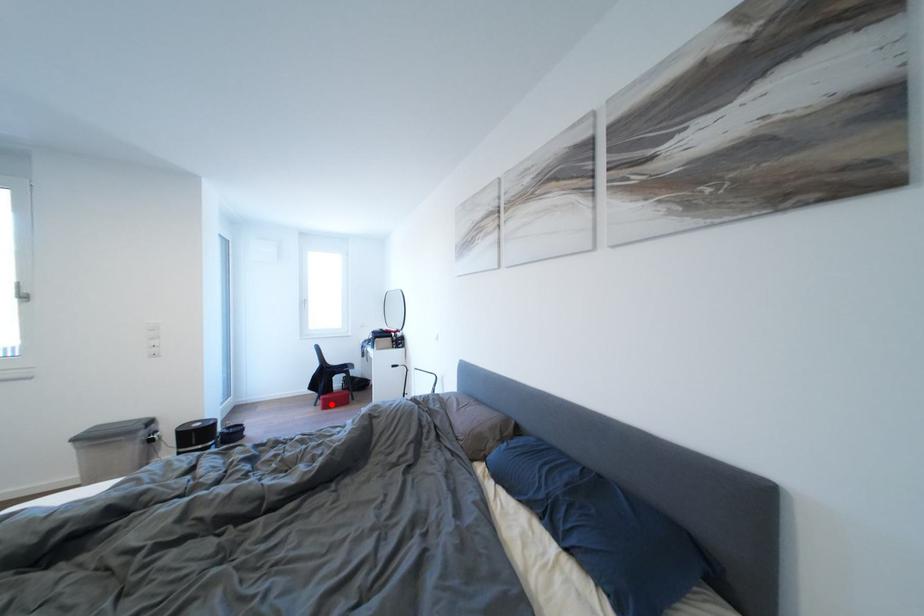
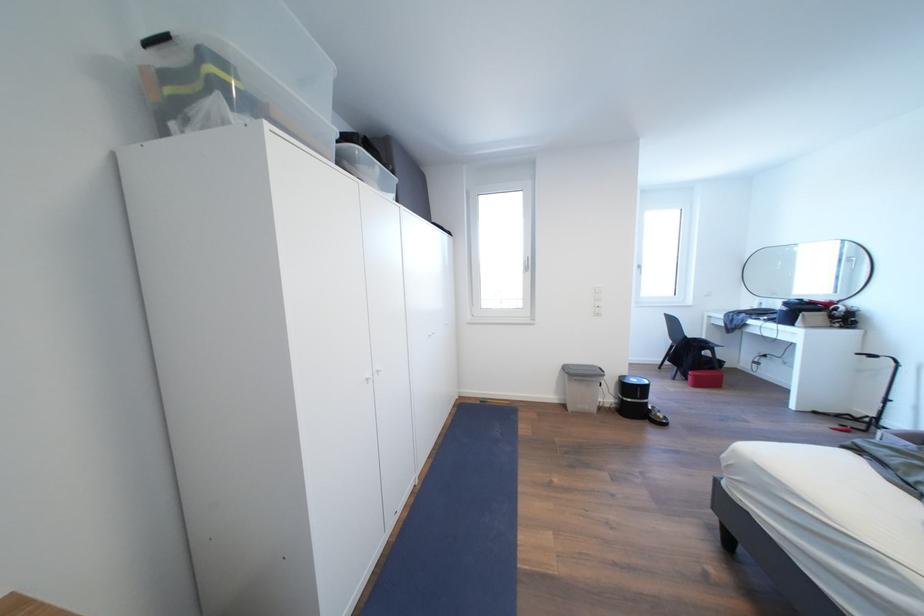
Question: I am providing you with two images of the same scene from different viewpoints. Image1 has a red point marked. In image2, the corresponding 3D location appears at what relative position? Reply with the corresponding letter.

Choices:
 (A) Closer
 (B) Farther

Answer: (A)